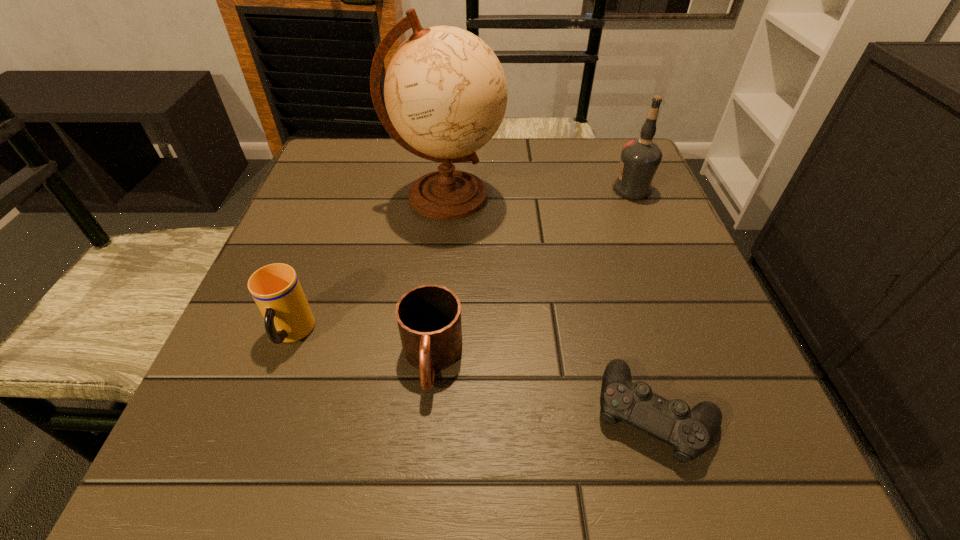
Image resolution: width=960 pixels, height=540 pixels. I want to click on globe, so click(445, 91).

Locate an element on the screen. The width and height of the screenshot is (960, 540). the second tallest object is located at coordinates (640, 158).

Where is `cup`? cup is located at coordinates (275, 288).

Locate an element on the screen. The image size is (960, 540). the third tallest object is located at coordinates (275, 288).

Image resolution: width=960 pixels, height=540 pixels. I want to click on mug, so click(429, 316).

Where is `the shortest object`? Image resolution: width=960 pixels, height=540 pixels. the shortest object is located at coordinates (689, 431).

What are the coordinates of `vacant position located on the surface of the globe` in the screenshot? It's located at (535, 196).

Locate an element on the screen. This screenshot has height=540, width=960. free space located on the front label of the vodka is located at coordinates (479, 190).

Locate an element on the screen. The image size is (960, 540). free space located on the front label of the vodka is located at coordinates (515, 190).

The height and width of the screenshot is (540, 960). I want to click on vacant area located 0.280m on the front label of the vodka, so click(x=488, y=190).